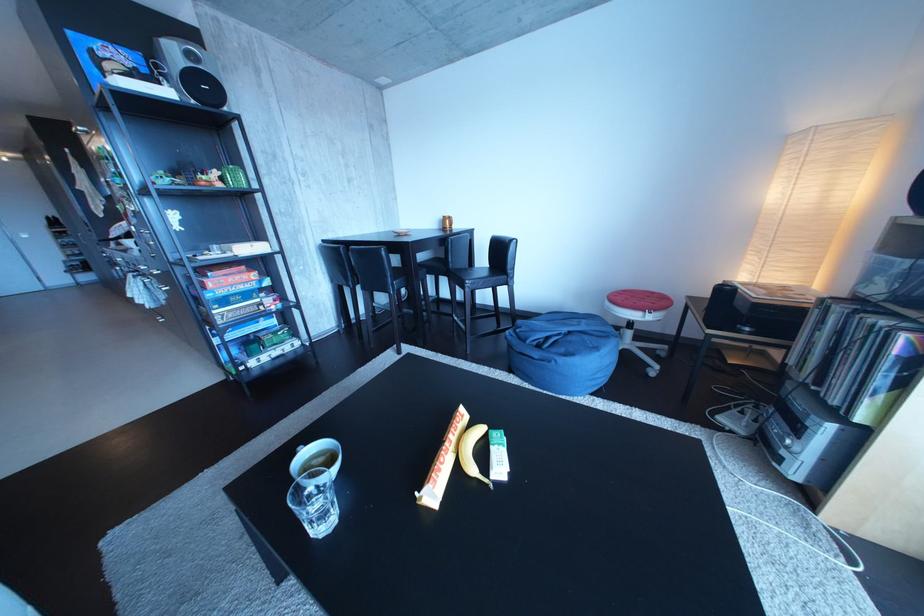
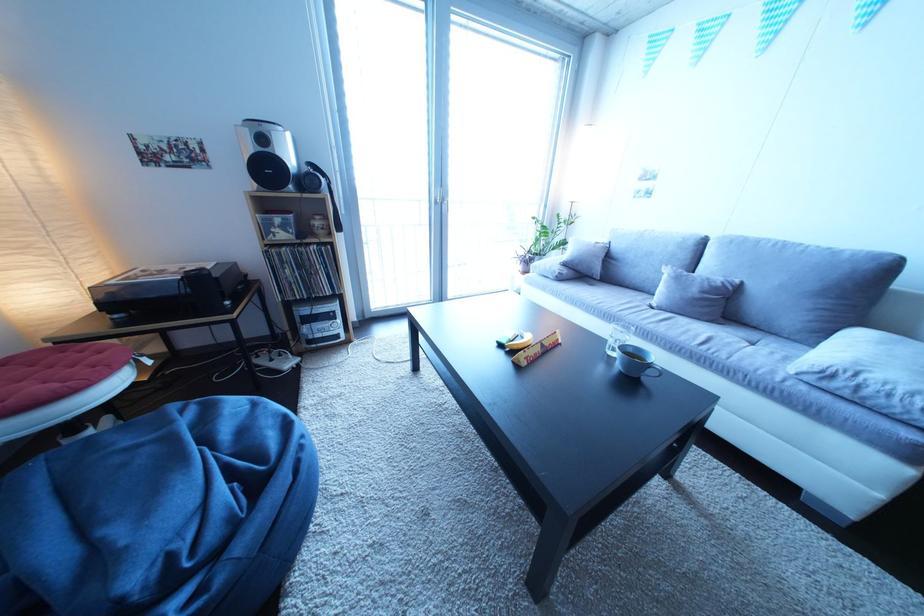
Question: I am providing you with two images of the same scene from different viewpoints. Which of the following objects are not visible in image2?

Choices:
 (A) pink wire basket
 (B) sofa sitting surface
 (C) vinyl record sleeve
 (D) clear drinking glass

Answer: (C)